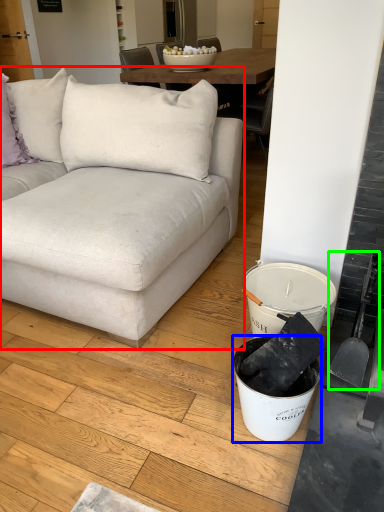
Question: Which is nearer to the studio couch (highlighted by a red box)? bucket (highlighted by a blue box) or shovel (highlighted by a green box).

Choices:
 (A) bucket
 (B) shovel

Answer: (A)